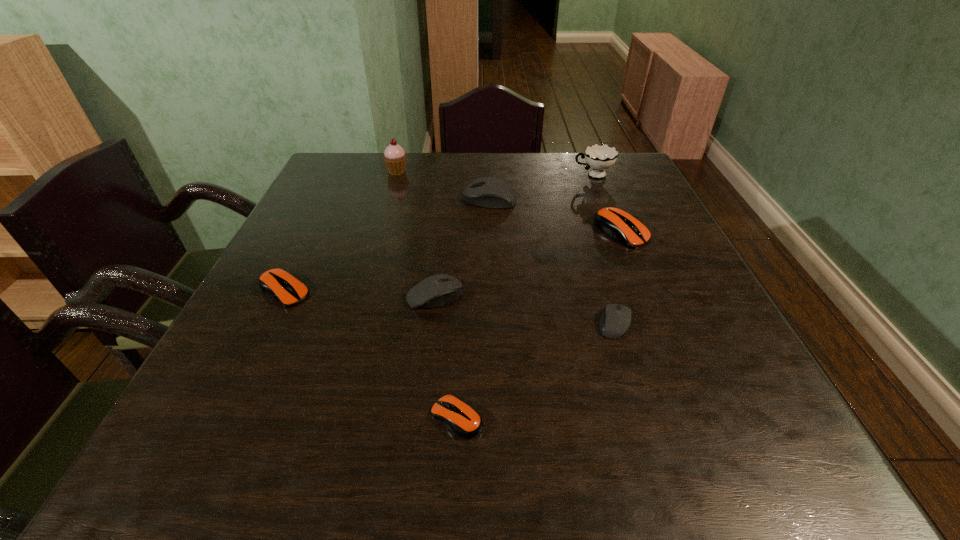
Locate an element on the screen. vacant space in between the second tallest object and the farthest computer mouse is located at coordinates (541, 187).

Where is `free space between the leftmost object and the shortest computer mouse`? Image resolution: width=960 pixels, height=540 pixels. free space between the leftmost object and the shortest computer mouse is located at coordinates (371, 355).

You are a GUI agent. You are given a task and a screenshot of the screen. Output one action in this format:
    pyautogui.click(x=<x>, y=<y>)
    Task: Click on the vacant space that's between the nearest orange computer mouse and the cup
    
    Given the screenshot: What is the action you would take?
    pyautogui.click(x=525, y=296)

I want to click on free space between the smallest orange computer mouse and the rightmost black computer equipment, so click(x=536, y=370).

The width and height of the screenshot is (960, 540). I want to click on empty location between the nearest orange computer mouse and the biggest black computer equipment, so click(x=473, y=309).

Where is `free space between the cup and the second orange computer mouse from left to right`? The width and height of the screenshot is (960, 540). free space between the cup and the second orange computer mouse from left to right is located at coordinates (525, 296).

What are the coordinates of `vacant space that is in between the rightmost black computer equipment and the sixth nearest object` in the screenshot? It's located at (552, 261).

Locate which object ranks seventh in proximity to the leftmost object. Please provide its 2D coordinates. Your answer should be formatted as a tuple, i.e. [(x, y)], where the tuple contains the x and y coordinates of a point satisfying the conditions above.

[(599, 157)]

The width and height of the screenshot is (960, 540). I want to click on object that can be found as the sixth closest to the smallest orange computer mouse, so click(599, 157).

Select which computer mouse is the fourth closest to the second smallest black computer equipment. Please provide its 2D coordinates. Your answer should be formatted as a tuple, i.e. [(x, y)], where the tuple contains the x and y coordinates of a point satisfying the conditions above.

[(489, 192)]